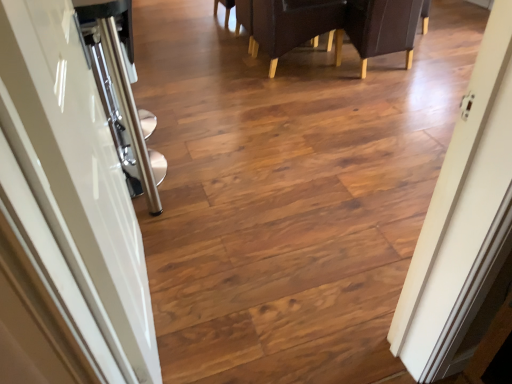
You are a GUI agent. You are given a task and a screenshot of the screen. Output one action in this format:
    pyautogui.click(x=<x>, y=<y>)
    Task: Click on the free region on the left part of dark brown leather armchair at upper center, acting as the first armchair starting from the left
    This screenshot has height=384, width=512.
    Given the screenshot: What is the action you would take?
    pyautogui.click(x=223, y=74)